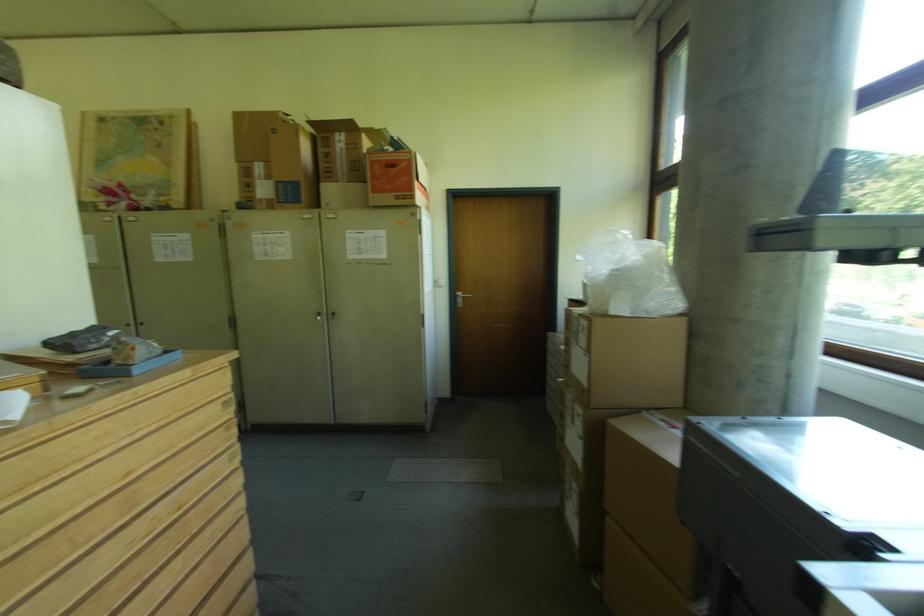
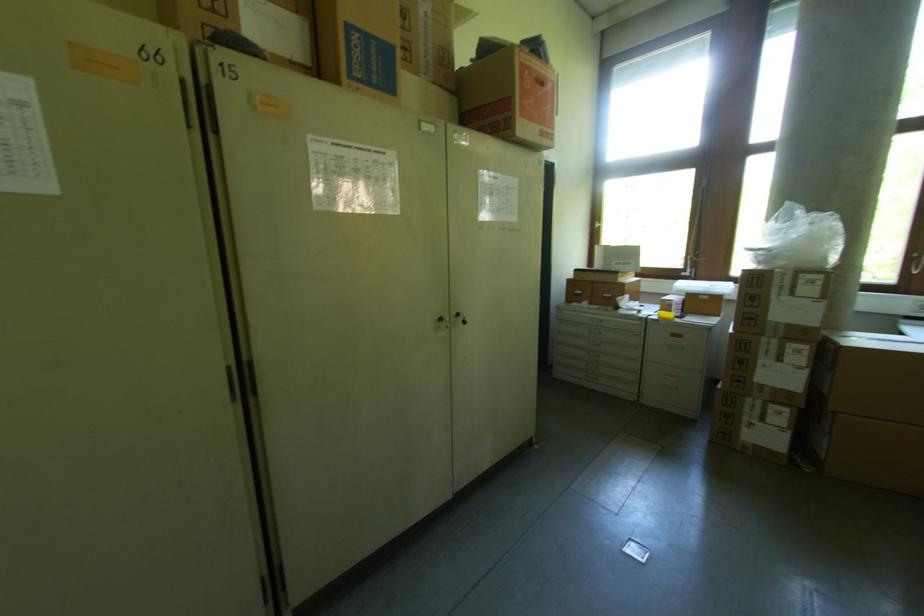
In the second image, find the point that corresponds to pixel 580 342 in the first image.

(795, 294)